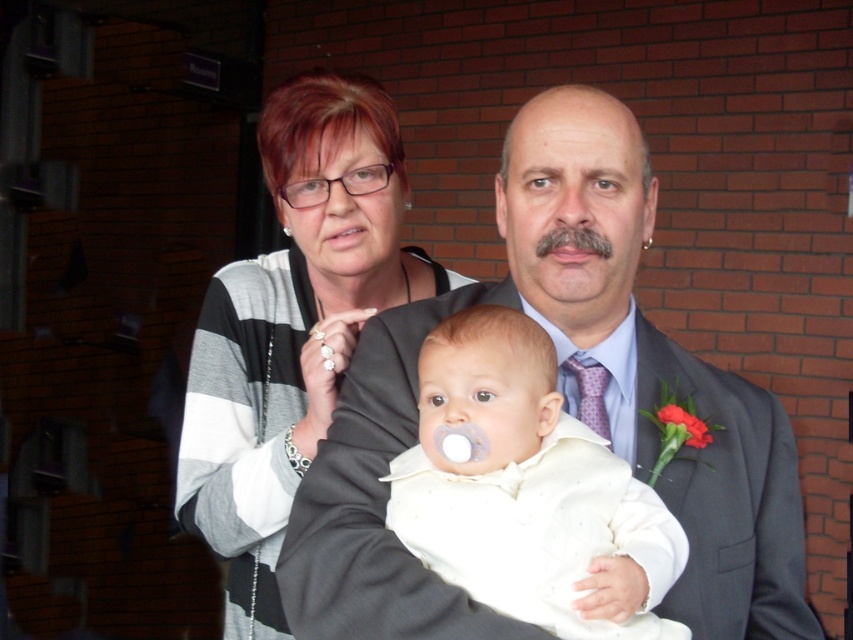
You are a photographer trying to take a photo of the gray striped sweater at center. You have a camera that requires a minimum distance of 1.5 meters to focus properly. Can you take the photo from your current position?

The gray striped sweater at center and camera are 1.53 meters apart, which is more than the required 1.5 meters, so yes, you can take the photo from your current position.